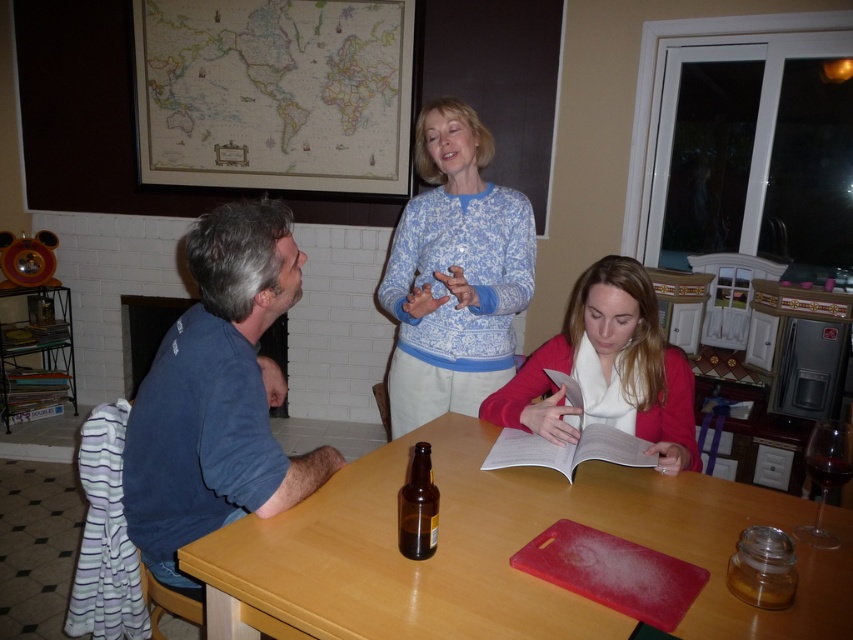
Can you confirm if wooden table at center is wider than blue cotton shirt at left?

Yes, wooden table at center is wider than blue cotton shirt at left.

Is wooden table at center shorter than blue cotton shirt at left?

Yes, wooden table at center is shorter than blue cotton shirt at left.

Describe the element at coordinates (498, 552) in the screenshot. This screenshot has width=853, height=640. I see `wooden table at center` at that location.

The image size is (853, 640). I want to click on wooden table at center, so click(498, 552).

Which is below, matte pink sweater at lower center or brown glass bottle at center?

brown glass bottle at center

Can you confirm if matte pink sweater at lower center is positioned above brown glass bottle at center?

Yes.

Which is in front, point (639, 417) or point (431, 477)?

Point (431, 477) is in front.

Where is `matte pink sweater at lower center`? matte pink sweater at lower center is located at coordinates (608, 368).

Does blue cotton shirt at left have a smaller size compared to matte pink sweater at lower center?

Incorrect, blue cotton shirt at left is not smaller in size than matte pink sweater at lower center.

Does point (160, 385) come in front of point (630, 392)?

Yes.

Is point (206, 310) farther from camera compared to point (538, 369)?

No, it is in front of (538, 369).

I want to click on blue cotton shirt at left, so click(218, 396).